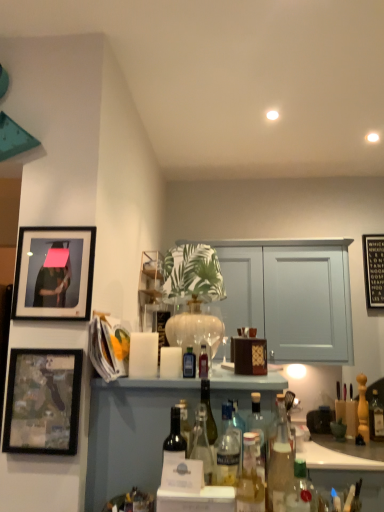
The height and width of the screenshot is (512, 384). What are the coordinates of `vacant space behind translucent glass bottle at center, the sixth bottle positioned from the right` in the screenshot? It's located at (211, 375).